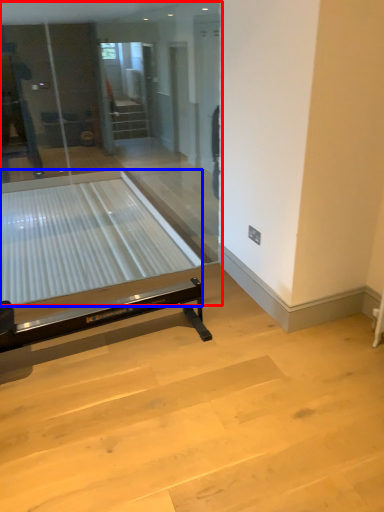
Question: Which object appears farthest to the camera in this image, glass door (highlighted by a red box) or glass table (highlighted by a blue box)?

Choices:
 (A) glass door
 (B) glass table

Answer: (B)